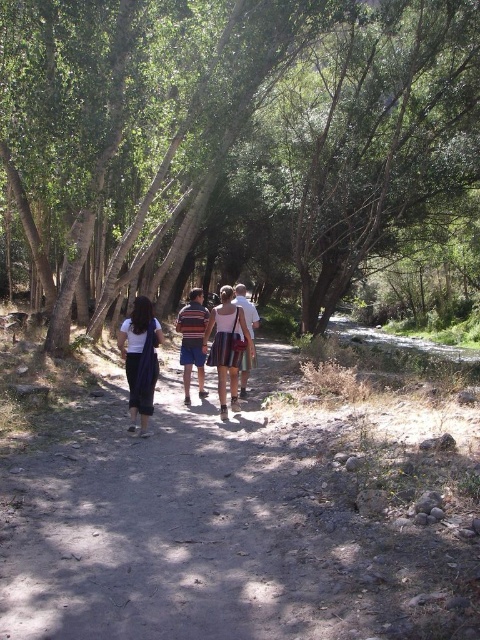
Is dark blue fabric pants at center to the right of white cotton shirt at center from the viewer's perspective?

In fact, dark blue fabric pants at center is to the left of white cotton shirt at center.

Can you confirm if dark blue fabric pants at center is smaller than white cotton shirt at center?

Yes.

What are the coordinates of `dark blue fabric pants at center` in the screenshot? It's located at (140, 358).

Who is higher up, green leafy tree at center or white cotton shirt at center?

Positioned higher is green leafy tree at center.

Between green leafy tree at center and white cotton shirt at center, which one appears on the left side from the viewer's perspective?

white cotton shirt at center

Identify the location of green leafy tree at center. This screenshot has width=480, height=640. (232, 134).

Is dark blue fabric pants at center bigger than striped fabric skirt at center?

Actually, dark blue fabric pants at center might be smaller than striped fabric skirt at center.

Is point (134, 317) behind point (224, 285)?

No, it is not.

You are a GUI agent. You are given a task and a screenshot of the screen. Output one action in this format:
    pyautogui.click(x=<x>, y=<y>)
    Task: Click on the dark blue fabric pants at center
    This screenshot has height=640, width=480.
    Given the screenshot: What is the action you would take?
    pyautogui.click(x=140, y=358)

Where is `dark blue fabric pants at center`? The width and height of the screenshot is (480, 640). dark blue fabric pants at center is located at coordinates point(140,358).